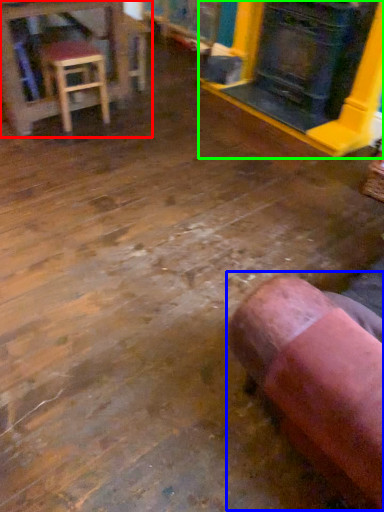
Question: Which object is the farthest from table (highlighted by a red box)? Choose among these: bean bag chair (highlighted by a blue box) or fireplace (highlighted by a green box).

Choices:
 (A) bean bag chair
 (B) fireplace

Answer: (A)